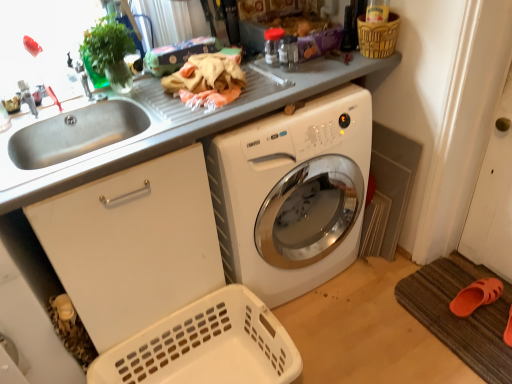
You are a GUI agent. You are given a task and a screenshot of the screen. Output one action in this format:
    pyautogui.click(x=<x>, y=<y>)
    Task: Click on the vacant area on top of brown textured bath mat at lower right (from a real-world perspective)
    
    Given the screenshot: What is the action you would take?
    pyautogui.click(x=461, y=305)